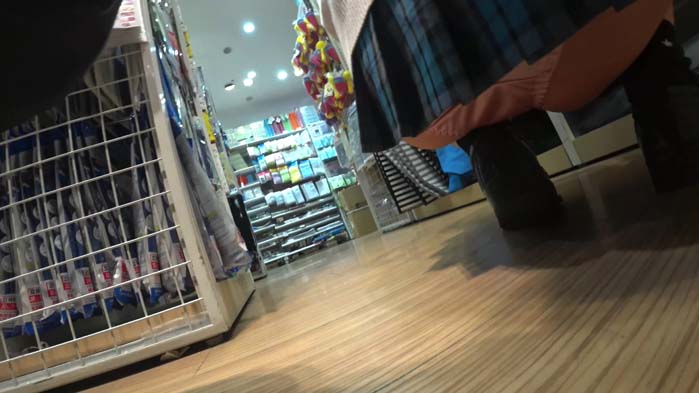
Where is `box`? The height and width of the screenshot is (393, 699). box is located at coordinates (344, 198).